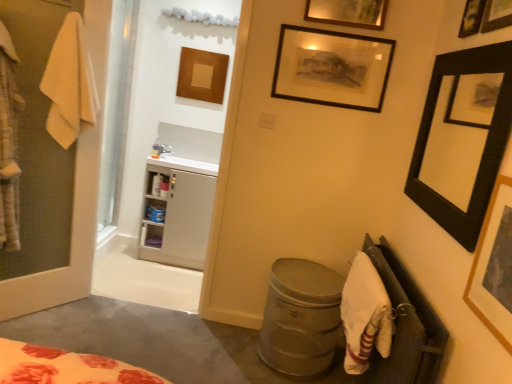
Measure the distance between point (x=374, y=313) and camera.

The depth of point (x=374, y=313) is 1.72 meters.

You are a GUI agent. You are given a task and a screenshot of the screen. Output one action in this format:
    pyautogui.click(x=<x>, y=<y>)
    Task: Click on the black matte picture frame at upper center, the 2th picture frame when ordered from back to front
    The width and height of the screenshot is (512, 384).
    Given the screenshot: What is the action you would take?
    pyautogui.click(x=332, y=68)

This screenshot has height=384, width=512. Describe the element at coordinates (332, 68) in the screenshot. I see `black matte picture frame at upper center, the 2th picture frame when ordered from back to front` at that location.

Describe the element at coordinates (485, 16) in the screenshot. I see `wooden framed picture at upper right, positioned as the first picture frame in right-to-left order` at that location.

The width and height of the screenshot is (512, 384). What do you see at coordinates (177, 212) in the screenshot? I see `white matte cabinet at center` at bounding box center [177, 212].

Find the location of a particular element. white cotton bath towel at lower right, which ranks as the second bath towel in left-to-right order is located at coordinates (365, 315).

In the scene shown: Which is less distant, (206, 168) or (334, 86)?

Clearly, point (206, 168) is more distant from the camera than point (334, 86).

From the image's perspective, is white glossy sink at upper left positioned above or below black matte picture frame at upper center, positioned as the fourth picture frame in right-to-left order?

Clearly, from the image's perspective, white glossy sink at upper left is below black matte picture frame at upper center, positioned as the fourth picture frame in right-to-left order.

In terms of height, does white glossy sink at upper left look taller or shorter compared to black matte picture frame at upper center, the 2th picture frame when ordered from back to front?

In the image, white glossy sink at upper left appears to be shorter than black matte picture frame at upper center, the 2th picture frame when ordered from back to front.

This screenshot has height=384, width=512. In order to click on sink that appears on the left of black matte picture frame at upper center, positioned as the fourth picture frame in right-to-left order in this screenshot , I will do `click(185, 164)`.

Which object is thinner, black matte picture frame at upper right, the second picture frame from the right, or white matte cabinet at center?

With smaller width is black matte picture frame at upper right, the second picture frame from the right.

Is black matte picture frame at upper right, the 3th picture frame in the back-to-front sequence, not inside white matte cabinet at center?

Yes, black matte picture frame at upper right, the 3th picture frame in the back-to-front sequence, is located beyond the bounds of white matte cabinet at center.

Is black matte picture frame at upper right, which is the third picture frame from front to back, to the left of white matte cabinet at center from the viewer's perspective?

Incorrect, black matte picture frame at upper right, which is the third picture frame from front to back, is not on the left side of white matte cabinet at center.

Where is `the 2nd picture frame in front of the white matte cabinet at center, counting from the anchor's position`? the 2nd picture frame in front of the white matte cabinet at center, counting from the anchor's position is located at coordinates (463, 138).

Is wooden framed picture at upper right, the fifth picture frame positioned from the left, facing away from white matte cabinet at center?

wooden framed picture at upper right, the fifth picture frame positioned from the left, is not turned away from white matte cabinet at center.

Does wooden framed picture at upper right, the fourth picture frame from the back, contain white matte cabinet at center?

That's incorrect, white matte cabinet at center is not inside wooden framed picture at upper right, the fourth picture frame from the back.

What's the angular difference between wooden framed picture at upper right, positioned as the first picture frame in right-to-left order, and white matte cabinet at center's facing directions?

90 degrees separate the facing orientations of wooden framed picture at upper right, positioned as the first picture frame in right-to-left order, and white matte cabinet at center.

In order to click on the 3rd picture frame in front of the white matte cabinet at center, counting from the anchor's position in this screenshot , I will do `click(485, 16)`.

Looking at this image, is the position of black matte picture frame at upper center, arranged as the 2th picture frame when viewed from the left, less distant than that of wooden framed artwork at upper right, the third picture frame from the left?

No, black matte picture frame at upper center, arranged as the 2th picture frame when viewed from the left, is further to the viewer.

Which is in front, point (317, 51) or point (506, 309)?

The point (506, 309) is closer to the camera.

From the image's perspective, which one is positioned lower, black matte picture frame at upper center, the 2th picture frame when ordered from back to front, or wooden framed artwork at upper right, the third picture frame from the left?

wooden framed artwork at upper right, the third picture frame from the left, from the image's perspective.

From a real-world perspective, is black matte picture frame at upper center, the 2th picture frame when ordered from back to front, located beneath wooden framed artwork at upper right, the third picture frame from the left?

No, from a real-world perspective, black matte picture frame at upper center, the 2th picture frame when ordered from back to front, is not below wooden framed artwork at upper right, the third picture frame from the left.

Is wooden square frame at upper center, the 5th picture frame in the front-to-back sequence, behind yellow cotton towel at left, positioned as the 1th bath towel in top-to-bottom order?

Yes, wooden square frame at upper center, the 5th picture frame in the front-to-back sequence, is further from the viewer.

Does wooden square frame at upper center, placed as the 5th picture frame when sorted from right to left, have a greater width compared to yellow cotton towel at left, positioned as the 1th bath towel in top-to-bottom order?

No.

Image resolution: width=512 pixels, height=384 pixels. There is a wooden square frame at upper center, the 5th picture frame in the front-to-back sequence. In order to click on the 1st bath towel below it (from the image's perspective) in this screenshot , I will do `click(70, 83)`.

How far apart are white matte cabinet at center and white cotton bath towel at lower right, placed as the 1th bath towel when sorted from right to left?

A distance of 5.68 feet exists between white matte cabinet at center and white cotton bath towel at lower right, placed as the 1th bath towel when sorted from right to left.

Considering their positions, is white matte cabinet at center located in front of or behind white cotton bath towel at lower right, which is counted as the second bath towel, starting from the top?

In the image, white matte cabinet at center appears behind white cotton bath towel at lower right, which is counted as the second bath towel, starting from the top.

Considering the relative sizes of white matte cabinet at center and white cotton bath towel at lower right, which is counted as the second bath towel, starting from the top, in the image provided, is white matte cabinet at center thinner than white cotton bath towel at lower right, which is counted as the second bath towel, starting from the top,?

No, white matte cabinet at center is not thinner than white cotton bath towel at lower right, which is counted as the second bath towel, starting from the top.

Which of these two, white matte cabinet at center or white cotton bath towel at lower right, the first bath towel from the bottom, is smaller?

Smaller between the two is white cotton bath towel at lower right, the first bath towel from the bottom.

Looking at their sizes, would you say yellow cotton towel at left, the 1th bath towel positioned from the left, is wider or thinner than wooden square frame at upper center, arranged as the 1th picture frame when viewed from the left?

Clearly, yellow cotton towel at left, the 1th bath towel positioned from the left, has more width compared to wooden square frame at upper center, arranged as the 1th picture frame when viewed from the left.

Can you tell me how much yellow cotton towel at left, which ranks as the 2th bath towel in bottom-to-top order, and wooden square frame at upper center, the 5th picture frame in the front-to-back sequence, differ in facing direction?

There is a 53.4-degree angle between the facing directions of yellow cotton towel at left, which ranks as the 2th bath towel in bottom-to-top order, and wooden square frame at upper center, the 5th picture frame in the front-to-back sequence.

Do you think yellow cotton towel at left, positioned as the 1th bath towel in top-to-bottom order, is within wooden square frame at upper center, placed as the 5th picture frame when sorted from right to left, or outside of it?

yellow cotton towel at left, positioned as the 1th bath towel in top-to-bottom order, cannot be found inside wooden square frame at upper center, placed as the 5th picture frame when sorted from right to left.

From the yellow cotton towel at left, positioned as the 1th bath towel in top-to-bottom order, count 2nd picture frames backward and point to it. Please provide its 2D coordinates.

[(202, 75)]

This screenshot has width=512, height=384. I want to click on the 2nd picture frame above when counting from the white glossy sink at upper left (from the image's perspective), so click(x=332, y=68).

This screenshot has width=512, height=384. I want to click on picture frame that is the 2nd object above the white matte cabinet at center (from a real-world perspective), so click(x=463, y=138).

Based on their spatial positions, is wooden framed artwork at upper right, positioned as the 5th picture frame in back-to-front order, or wooden framed picture at upper right, the fourth picture frame from the back, closer to white cotton bath towel at lower right, the first bath towel from the bottom?

wooden framed artwork at upper right, positioned as the 5th picture frame in back-to-front order.

From the image, which object appears to be farther from white fabric at lower right, black matte picture frame at upper center, positioned as the fourth picture frame in right-to-left order, or white matte cabinet at center?

white matte cabinet at center is positioned further to the anchor white fabric at lower right.

From the image, which object appears to be nearer to wooden framed artwork at upper right, the third picture frame when ordered from right to left, white glossy sink at upper left or wooden square frame at upper center, placed as the 5th picture frame when sorted from right to left?

white glossy sink at upper left.

Looking at the image, which one is located closer to white glossy sink at upper left, wooden framed picture at upper right, positioned as the first picture frame in right-to-left order, or wooden square frame at upper center, which ranks as the 1th picture frame in back-to-front order?

Based on the image, wooden square frame at upper center, which ranks as the 1th picture frame in back-to-front order, appears to be nearer to white glossy sink at upper left.

Based on their spatial positions, is black matte picture frame at upper right, the 3th picture frame in the back-to-front sequence, or white matte cabinet at center further from white glossy sink at upper left?

Among the two, black matte picture frame at upper right, the 3th picture frame in the back-to-front sequence, is located further to white glossy sink at upper left.

Estimate the real-world distances between objects in this image. Which object is closer to yellow cotton towel at left, positioned as the 1th bath towel in top-to-bottom order, wooden framed artwork at upper right, positioned as the 5th picture frame in back-to-front order, or black matte picture frame at upper center, the 2th picture frame when ordered from back to front?

Among the two, black matte picture frame at upper center, the 2th picture frame when ordered from back to front, is located nearer to yellow cotton towel at left, positioned as the 1th bath towel in top-to-bottom order.

Considering their positions, is white fabric at lower right positioned closer to black matte picture frame at upper right, the 3th picture frame in the back-to-front sequence, than white glossy sink at upper left?

Based on the image, white fabric at lower right appears to be nearer to black matte picture frame at upper right, the 3th picture frame in the back-to-front sequence.

Which object lies further to the anchor point white fabric at lower right, wooden square frame at upper center, the 5th picture frame in the front-to-back sequence, or black matte picture frame at upper right, which is the third picture frame from front to back?

The object further to white fabric at lower right is wooden square frame at upper center, the 5th picture frame in the front-to-back sequence.

Locate an element on the screen. The height and width of the screenshot is (384, 512). bathroom cabinet positioned between yellow cotton towel at left, the 2th bath towel when ordered from right to left, and wooden square frame at upper center, arranged as the 1th picture frame when viewed from the left, from near to far is located at coordinates (177, 212).

What are the coordinates of `bathroom cabinet between black matte picture frame at upper right, which is the third picture frame from front to back, and wooden square frame at upper center, arranged as the 1th picture frame when viewed from the left, in the front-back direction` in the screenshot? It's located at click(x=177, y=212).

Find the location of a particular element. Image resolution: width=512 pixels, height=384 pixels. closet between wooden framed artwork at upper right, positioned as the 5th picture frame in back-to-front order, and white matte cabinet at center, along the z-axis is located at coordinates pyautogui.click(x=405, y=326).

At what (x,y) coordinates should I click in order to perform the action: click on closet positioned between wooden framed picture at upper right, positioned as the first picture frame in right-to-left order, and white matte cabinet at center from near to far. Please return your answer as a coordinate pair (x, y). This screenshot has width=512, height=384. Looking at the image, I should click on click(x=405, y=326).